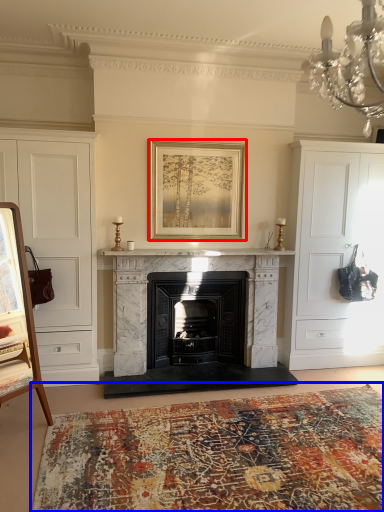
Question: Which point is closer to the camera, picture frame (highlighted by a red box) or plain (highlighted by a blue box)?

Choices:
 (A) picture frame
 (B) plain

Answer: (B)